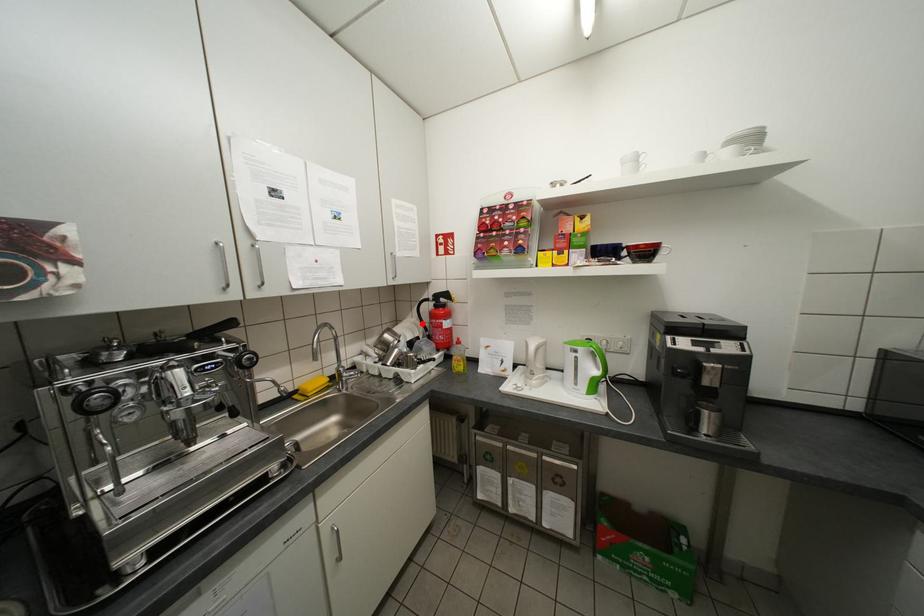
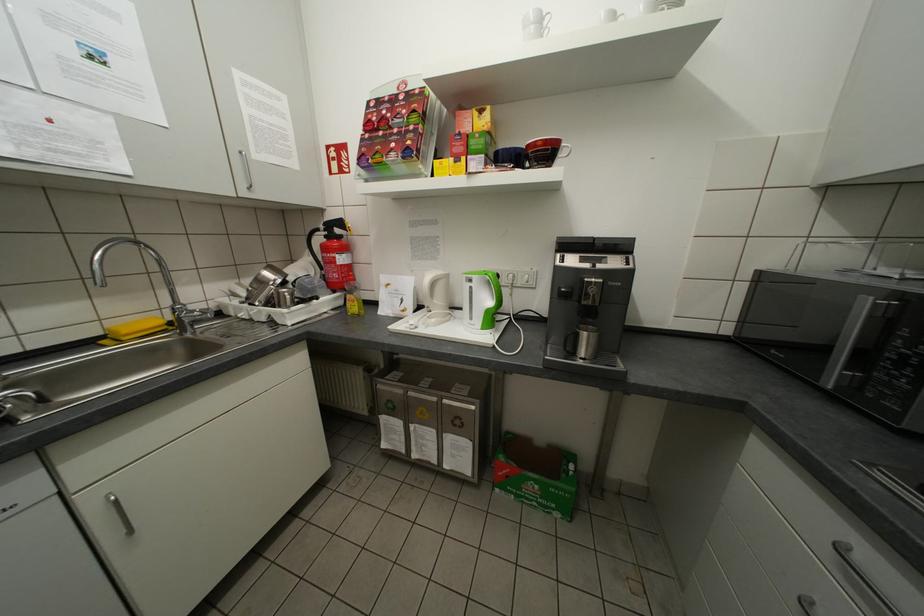
The point at the highlighted location is marked in the first image. Where is the corresponding point in the second image?

(319, 262)